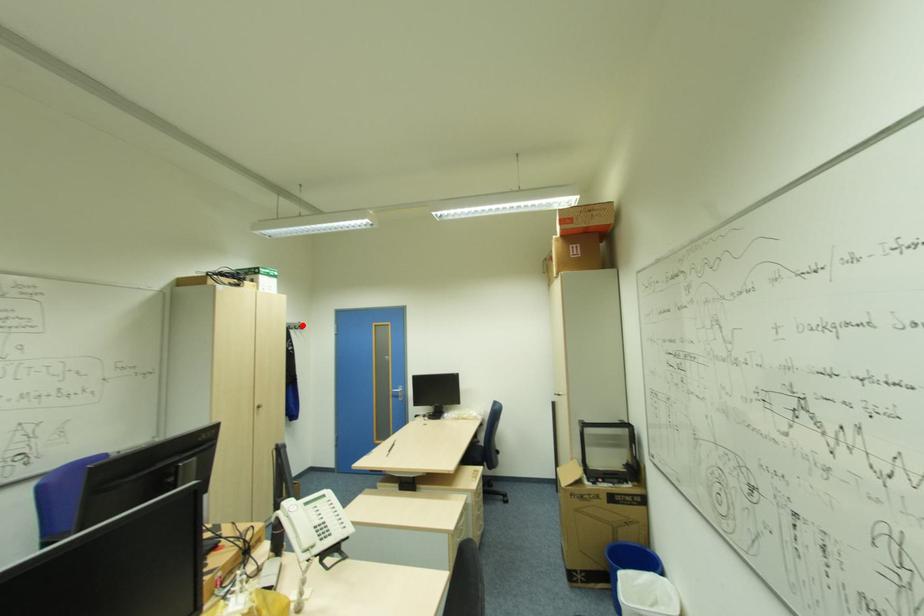
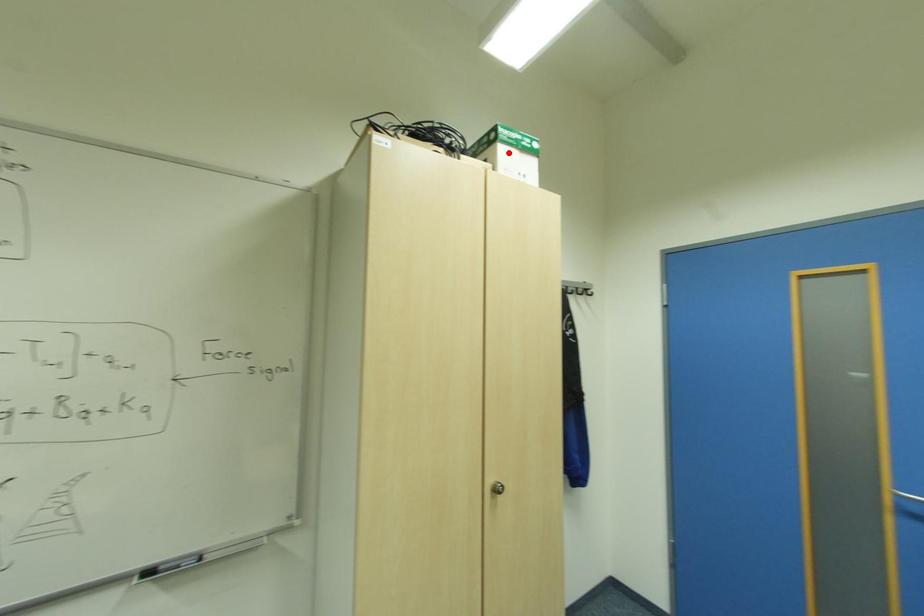
I am providing you with two images of the same scene from different viewpoints. A red point is marked on the first image and another point is marked on the second image. Are the points marked in image1 and image2 representing the same 3D position?

No